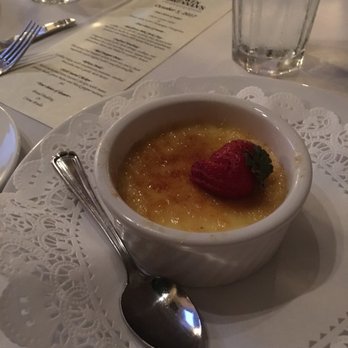
Locate an element on the screen. This screenshot has width=348, height=348. placemat is located at coordinates (58, 312).